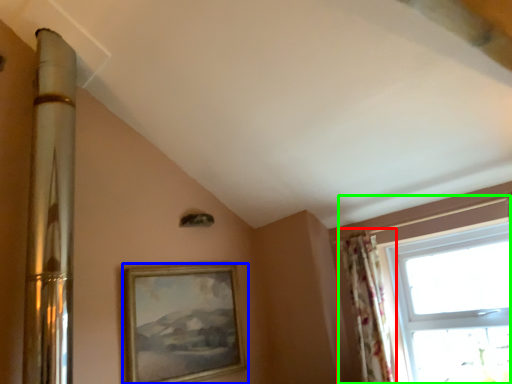
Question: Which object is positioned closest to curtain (highlighted by a red box)? Select from picture frame (highlighted by a blue box) and window (highlighted by a green box).

Choices:
 (A) picture frame
 (B) window

Answer: (B)